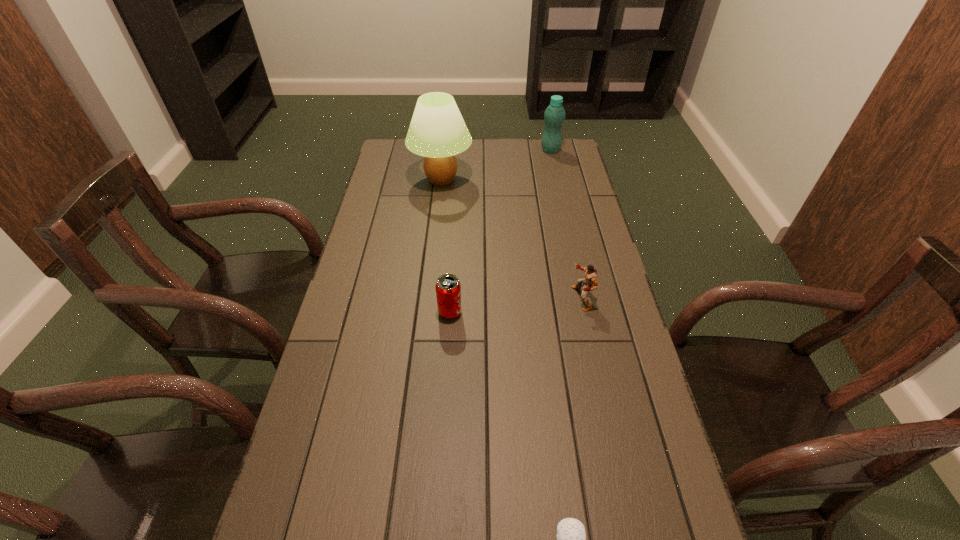
Where is `object that is the closest to the puncher`? The image size is (960, 540). object that is the closest to the puncher is located at coordinates (448, 288).

At what (x,y) coordinates should I click in order to perform the action: click on free space that satisfies the following two spatial constraints: 1. on the shade of the tallest object; 2. on the left side of the soda can. Please return your answer as a coordinate pair (x, y). Looking at the image, I should click on (426, 313).

Locate an element on the screen. This screenshot has width=960, height=540. vacant space that satisfies the following two spatial constraints: 1. at the front cap of the fourth shortest object; 2. on the shade of the tallest object is located at coordinates (558, 180).

What are the coordinates of `free space that satisfies the following two spatial constraints: 1. at the front cap of the farthest object; 2. on the shade of the lampshade` in the screenshot? It's located at click(558, 180).